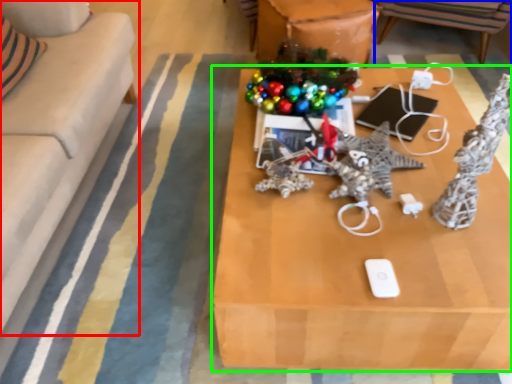
Question: Which object is the farthest from studio couch (highlighted by a red box)? Choose among these: chair (highlighted by a blue box) or table (highlighted by a green box).

Choices:
 (A) chair
 (B) table

Answer: (A)